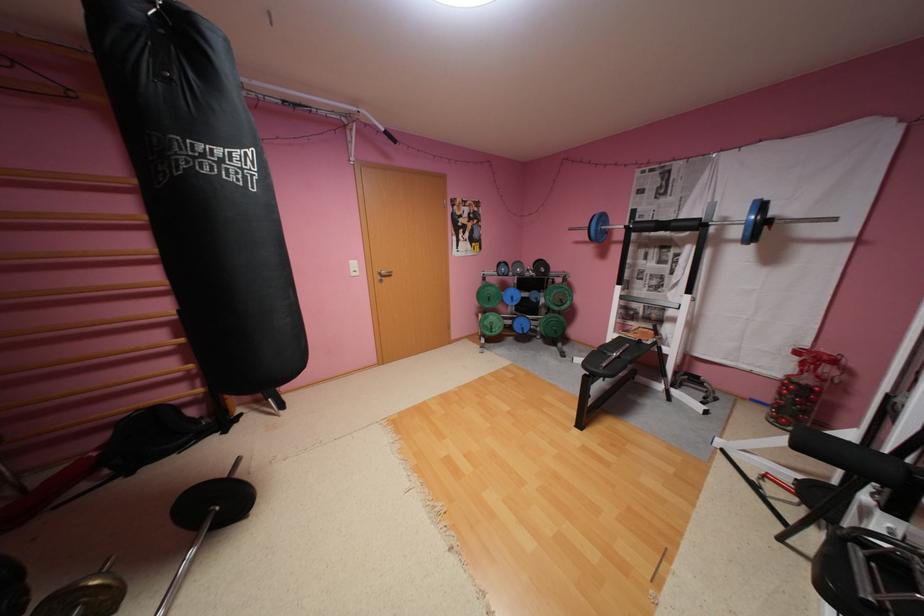
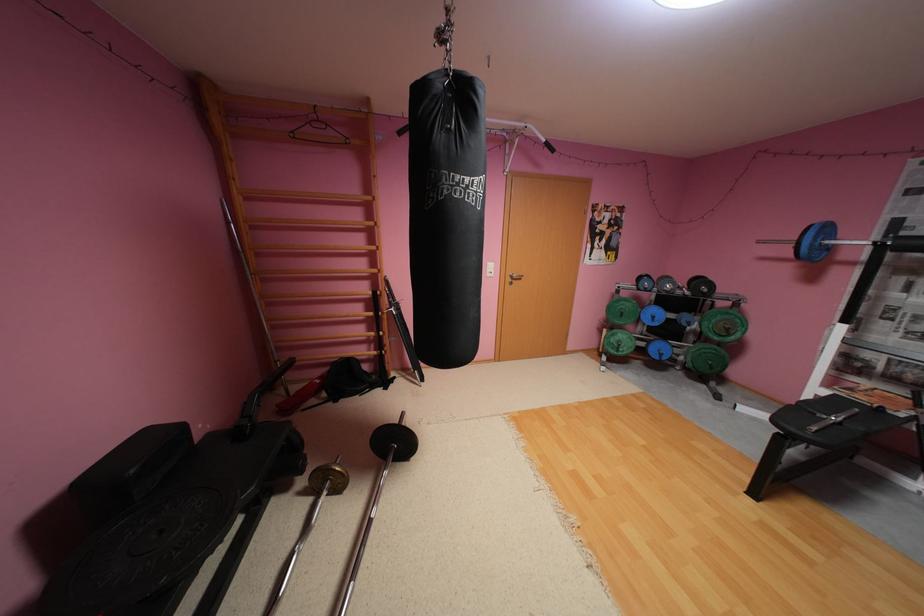
In the second image, find the point that corresponds to point (501, 331) in the first image.

(626, 351)